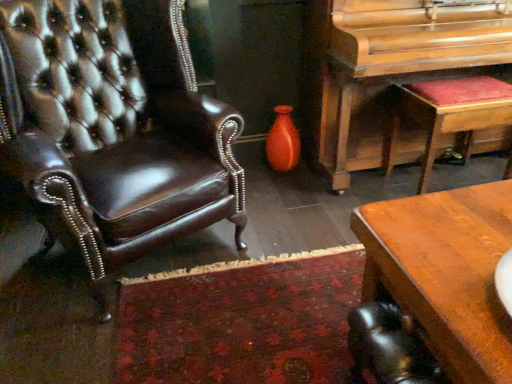
Where is `vacant point above velvet red stool at right (from a real-world perspective)`? The image size is (512, 384). vacant point above velvet red stool at right (from a real-world perspective) is located at coordinates (466, 88).